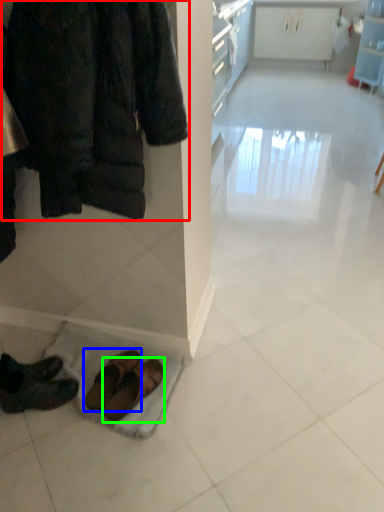
Question: Based on their relative distances, which object is nearer to jacket (highlighted by a red box)? Choose from footwear (highlighted by a blue box) and footwear (highlighted by a green box).

Choices:
 (A) footwear
 (B) footwear

Answer: (A)